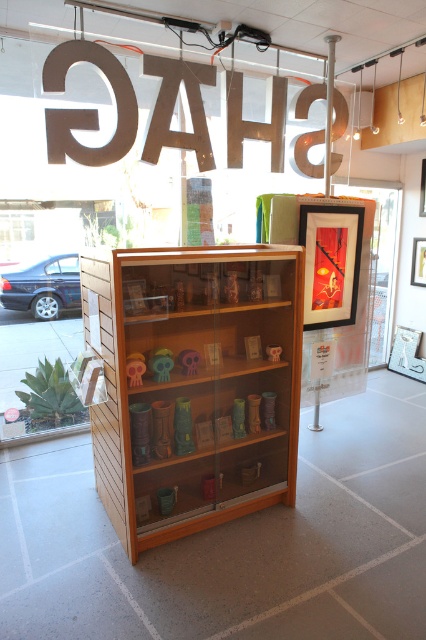
Does wooden shelf at center appear on the left side of transparent glass door at center?

Yes, wooden shelf at center is to the left of transparent glass door at center.

Can you confirm if wooden shelf at center is bigger than transparent glass door at center?

No, wooden shelf at center is not bigger than transparent glass door at center.

Who is more distant from viewer, (287, 268) or (394, 260)?

The point (394, 260) is behind.

The image size is (426, 640). Find the location of `wooden shelf at center`. wooden shelf at center is located at coordinates (192, 385).